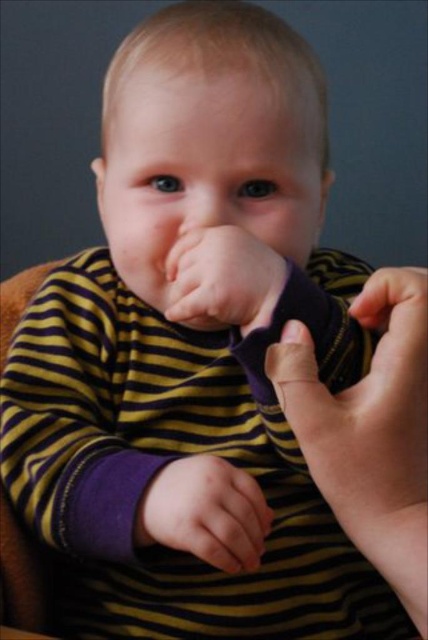
Can you confirm if purple fabric at lower right is positioned to the right of smooth flesh nose at center?

Yes, purple fabric at lower right is to the right of smooth flesh nose at center.

Does purple fabric at lower right appear over smooth flesh nose at center?

No, purple fabric at lower right is not above smooth flesh nose at center.

Between point (388, 500) and point (189, 224), which one is positioned in front?

Positioned in front is point (388, 500).

Identify the location of purple fabric at lower right. This screenshot has height=640, width=428. coord(366,413).

The width and height of the screenshot is (428, 640). I want to click on purple fabric at lower right, so click(366, 413).

Who is shorter, purple fabric at lower right or purple soft fabric hand at center?

purple soft fabric hand at center

Locate an element on the screen. purple fabric at lower right is located at coordinates (366, 413).

At what (x,y) coordinates should I click in order to perform the action: click on purple fabric at lower right. Please return your answer as a coordinate pair (x, y). Image resolution: width=428 pixels, height=640 pixels. Looking at the image, I should click on (366, 413).

Who is more forward, (247, 496) or (193, 266)?

Point (247, 496) is in front.

Looking at this image, who is lower down, purple soft fabric hand at center or smooth skin hand at center?

purple soft fabric hand at center

Is point (181, 518) positioned after point (238, 316)?

Yes, point (181, 518) is behind point (238, 316).

Where is `purple soft fabric hand at center`? The height and width of the screenshot is (640, 428). purple soft fabric hand at center is located at coordinates (205, 513).